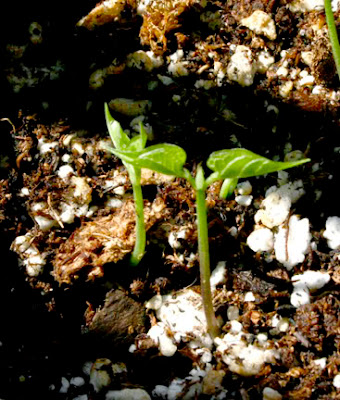
This screenshot has height=400, width=340. I want to click on plant, so click(x=133, y=195), click(x=331, y=36), click(x=206, y=272).